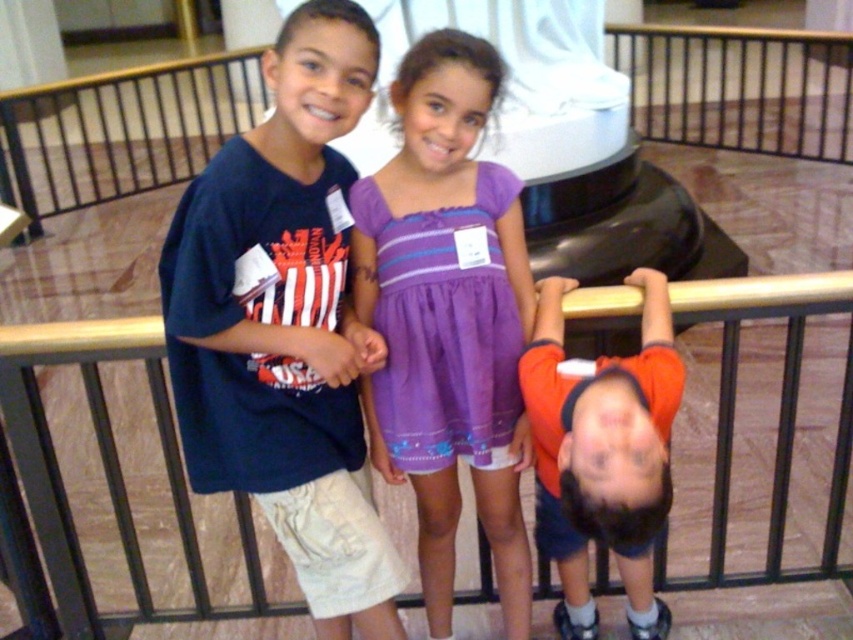
You are a photographer trying to capture a photo of the two children. The purple cotton dress at center and the black metal railing at upper center are both in the frame. Which object takes up more space in the photo?

The black metal railing at upper center takes up more space in the photo because it is larger than the purple cotton dress at center.

You are a photographer trying to capture a photo of the orange fabric shirt at lower right and the black metal railing at upper center. Can you fit both subjects into your camera frame if your camera has a maximum field of view of 5 meters?

The orange fabric shirt at lower right and the black metal railing at upper center are 5.26 meters apart from each other. Since the camera can only capture up to 5 meters, the distance between them exceeds the maximum field of view, so both subjects cannot be captured in the same frame.